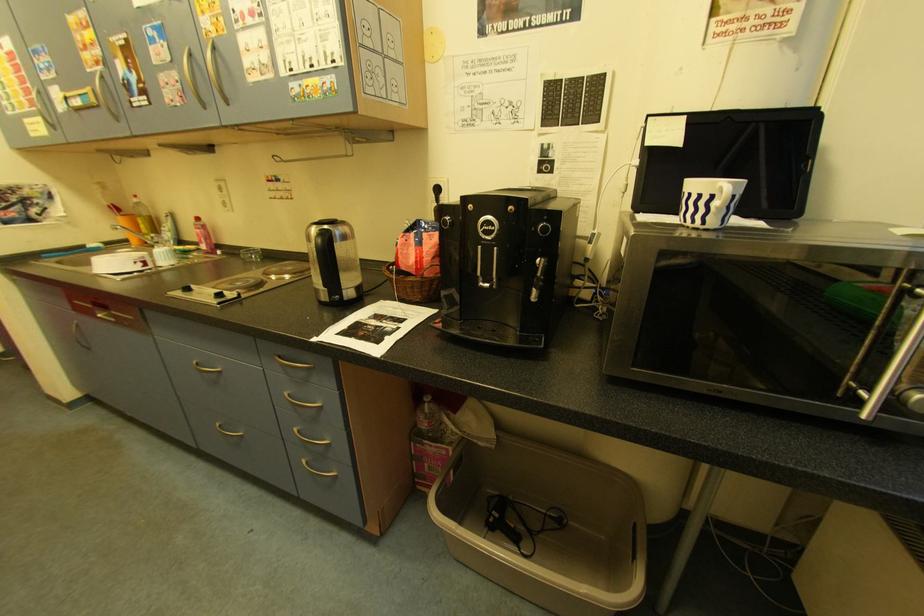
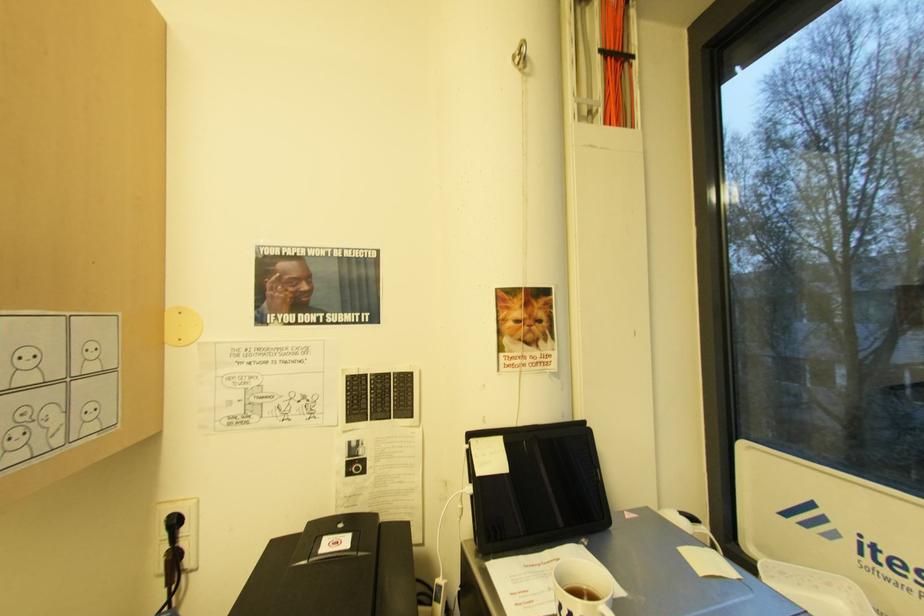
How did the camera likely rotate?

The camera's rotation is toward right-up.